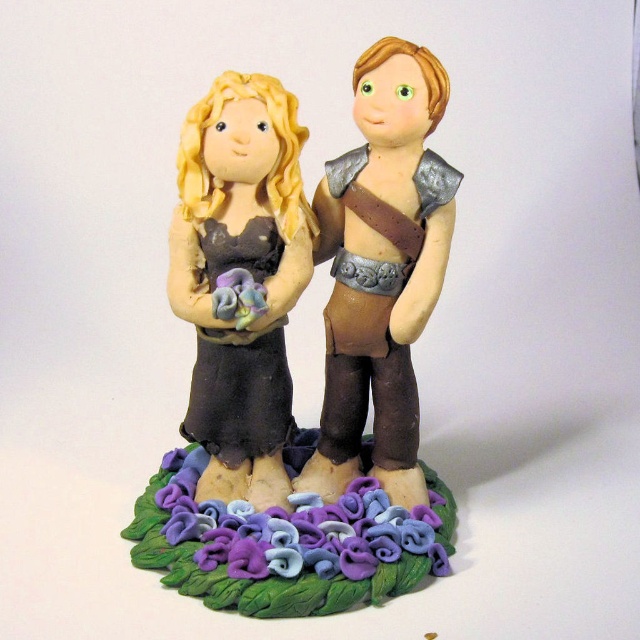
Question: Which object appears farthest from the camera in this image?

Choices:
 (A) brown leather armor at center
 (B) purple clay flowers at center
 (C) matte brown dress at center

Answer: (A)

Question: Among these objects, which one is farthest from the camera?

Choices:
 (A) purple clay flowers at center
 (B) matte brown figurine at center

Answer: (B)

Question: Does brown leather armor at center have a lesser width compared to purple clay flowers at center?

Choices:
 (A) no
 (B) yes

Answer: (B)

Question: Is matte brown figurine at center wider than matte brown dress at center?

Choices:
 (A) no
 (B) yes

Answer: (B)

Question: Which point appears farthest from the camera in this image?

Choices:
 (A) (276, 308)
 (B) (340, 566)
 (C) (362, 417)
 (D) (166, 456)

Answer: (D)

Question: Is matte brown dress at center to the left of purple clay flowers at center from the viewer's perspective?

Choices:
 (A) yes
 (B) no

Answer: (A)